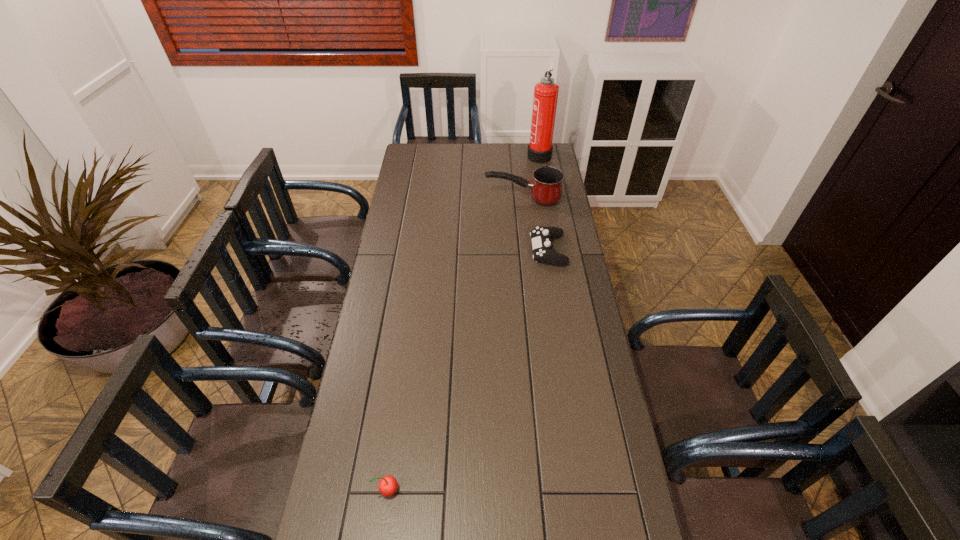
What are the coordinates of `free location located 0.210m on the front-facing side of the fire extinguisher` in the screenshot? It's located at (486, 154).

Identify the location of free space located 0.190m on the handle side of the second farthest object. (443, 199).

Identify the location of free space located on the handle side of the second farthest object. (458, 199).

At what (x,y) coordinates should I click in order to perform the action: click on vacant space located on the handle side of the second farthest object. Please return your answer as a coordinate pair (x, y). Looking at the image, I should click on (456, 199).

Locate an element on the screen. vacant space located on the right of the nearest object is located at coordinates (507, 489).

The image size is (960, 540). What are the coordinates of `free region located 0.260m on the surface of the third farthest object` in the screenshot? It's located at (467, 251).

You are a GUI agent. You are given a task and a screenshot of the screen. Output one action in this format:
    pyautogui.click(x=<x>, y=<y>)
    Task: Click on the vacant region located 0.380m on the surface of the third farthest object
    The height and width of the screenshot is (540, 960).
    Given the screenshot: What is the action you would take?
    pyautogui.click(x=437, y=251)

The height and width of the screenshot is (540, 960). In order to click on free region located on the surface of the third farthest object in this screenshot , I will do `click(457, 251)`.

Where is `object present at the far edge`? The width and height of the screenshot is (960, 540). object present at the far edge is located at coordinates (540, 148).

You are a GUI agent. You are given a task and a screenshot of the screen. Output one action in this format:
    pyautogui.click(x=<x>, y=<y>)
    Task: Click on the object situated at the left edge
    
    Given the screenshot: What is the action you would take?
    pyautogui.click(x=387, y=486)